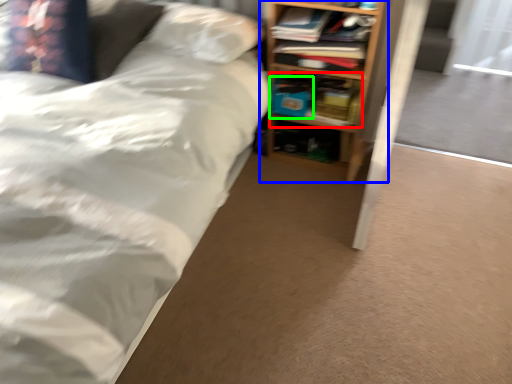
Question: Which is nearer to the book (highlighted by a red box)? shelf (highlighted by a blue box) or paperback book (highlighted by a green box).

Choices:
 (A) shelf
 (B) paperback book

Answer: (B)